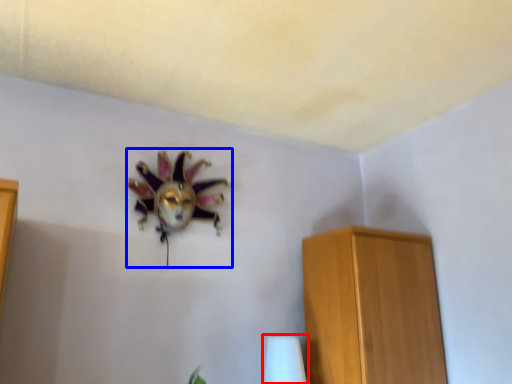
Question: Which object is closer to the camera taking this photo, table lamp (highlighted by a red box) or animal (highlighted by a blue box)?

Choices:
 (A) table lamp
 (B) animal

Answer: (B)